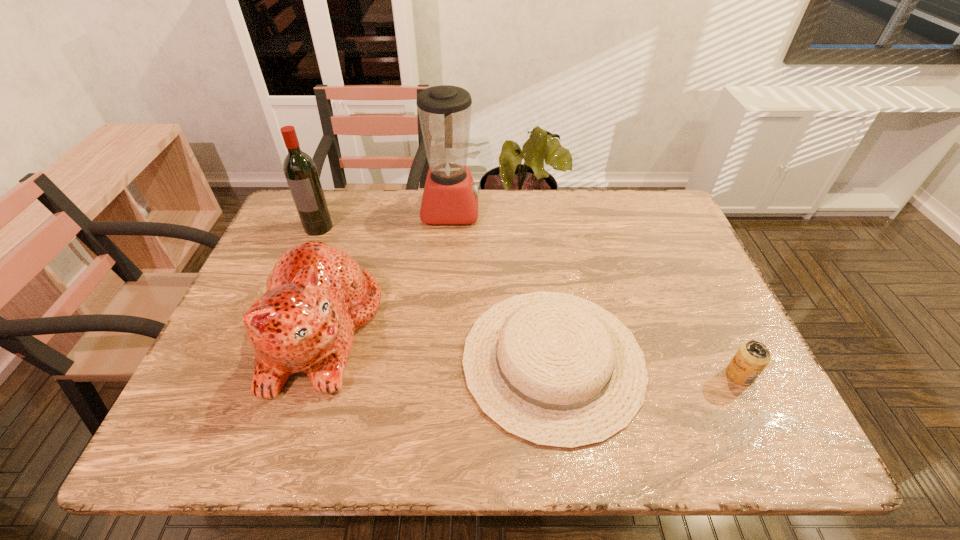
You are a GUI agent. You are given a task and a screenshot of the screen. Output one action in this format:
    pyautogui.click(x=<x>, y=<y>)
    Task: Click on the free space in the image that satisfies the following two spatial constraints: 1. on the label of the wine bottle; 2. on the left side of the second shortest object
    Image resolution: width=960 pixels, height=540 pixels.
    Given the screenshot: What is the action you would take?
    pyautogui.click(x=257, y=375)

The height and width of the screenshot is (540, 960). Identify the location of vacant area that satisfies the following two spatial constraints: 1. on the front of the sunhat near the controls; 2. on the right side of the tallest object. (439, 361).

Locate an element on the screen. The image size is (960, 540). free spot that satisfies the following two spatial constraints: 1. on the back side of the fourth tallest object; 2. on the front of the blender near the controls is located at coordinates (660, 210).